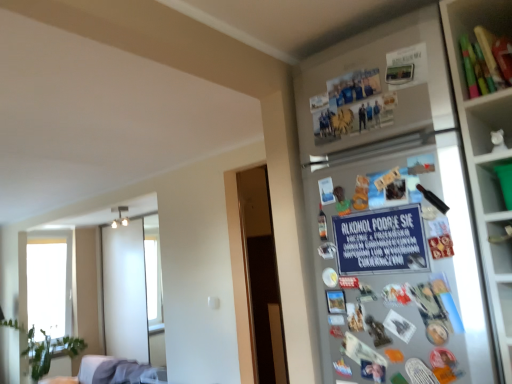
Question: Can you confirm if blue paper sign at upper right is taller than transparent glass window at left?

Choices:
 (A) no
 (B) yes

Answer: (A)

Question: Does blue paper sign at upper right have a lesser height compared to transparent glass window at left?

Choices:
 (A) yes
 (B) no

Answer: (A)

Question: Is the position of blue paper sign at upper right less distant than that of transparent glass window at left?

Choices:
 (A) yes
 (B) no

Answer: (A)

Question: Does blue paper sign at upper right have a lesser width compared to transparent glass window at left?

Choices:
 (A) yes
 (B) no

Answer: (A)

Question: Is blue paper sign at upper right directly adjacent to transparent glass window at left?

Choices:
 (A) yes
 (B) no

Answer: (B)

Question: Is green plastic container at upper right in front of or behind matte plastic utensils at upper right in the image?

Choices:
 (A) behind
 (B) front

Answer: (B)

Question: From a real-world perspective, is green plastic container at upper right positioned above or below matte plastic utensils at upper right?

Choices:
 (A) above
 (B) below

Answer: (B)

Question: Is point (483, 172) closer or farther from the camera than point (476, 21)?

Choices:
 (A) farther
 (B) closer

Answer: (B)

Question: Looking at their shapes, would you say green plastic container at upper right is wider or thinner than matte plastic utensils at upper right?

Choices:
 (A) thin
 (B) wide

Answer: (B)

Question: Is point (389, 216) positioned closer to the camera than point (453, 170)?

Choices:
 (A) closer
 (B) farther

Answer: (B)

Question: Based on their positions, is blue paper sign at upper right located to the left or right of silver metallic fridge at upper right?

Choices:
 (A) left
 (B) right

Answer: (A)

Question: From the image's perspective, is blue paper sign at upper right located above or below silver metallic fridge at upper right?

Choices:
 (A) below
 (B) above

Answer: (B)

Question: Looking at the image, does blue paper sign at upper right seem bigger or smaller compared to silver metallic fridge at upper right?

Choices:
 (A) small
 (B) big

Answer: (A)

Question: Is transparent glass window at left inside the boundaries of green plastic container at upper right, or outside?

Choices:
 (A) inside
 (B) outside

Answer: (B)

Question: In the image, is transparent glass window at left positioned in front of or behind green plastic container at upper right?

Choices:
 (A) behind
 (B) front

Answer: (A)